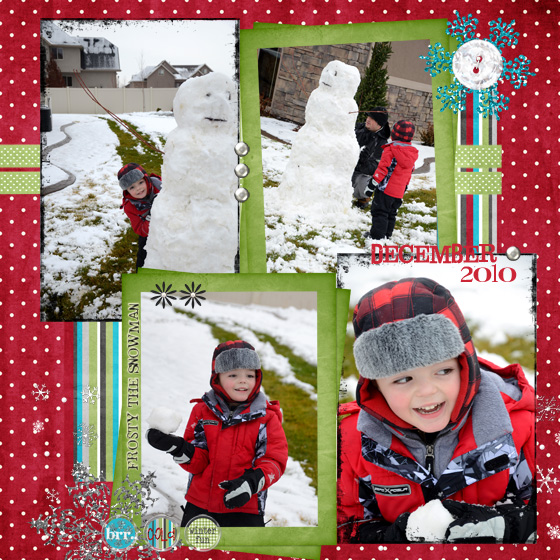
Image resolution: width=560 pixels, height=560 pixels. I want to click on pictures, so click(452, 339), click(164, 129).